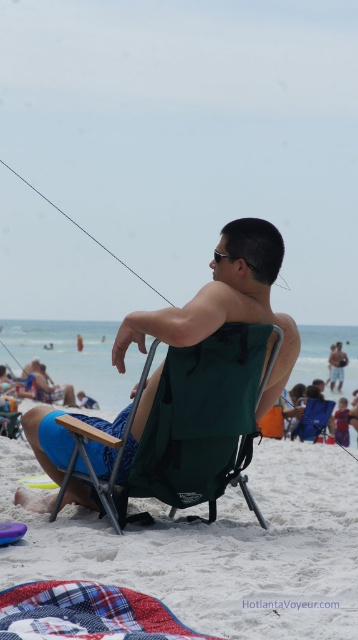
You are a lifeguard standing on the beach and need to place a large cooler between the green fabric chair at center and the metallic wire fishing pole at upper left. Which object should you move to make space?

The green fabric chair at center is wider than the metallic wire fishing pole at upper left, so you should move the green fabric chair at center to make space for the cooler.

You are standing at the point marked by the coordinates point (215,547). What object are you standing on?

The point (215,547) marks the green fabric chair at center, so you are standing on the green fabric chair at center.

You are standing at the point with coordinates [197,424] in the beach scene. What object are you standing on?

The point with coordinates [197,424] is on the green fabric folding chair at center.